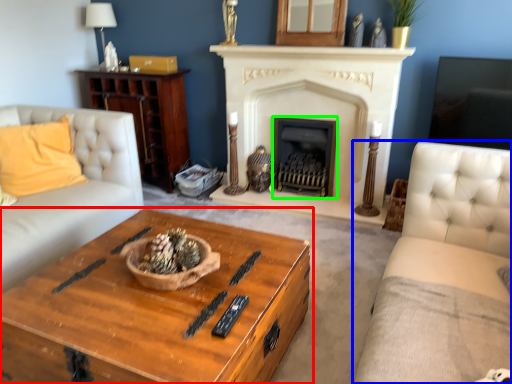
Question: Estimate the real-world distances between objects in this image. Which object is closer to coffee table (highlighted by a red box), studio couch (highlighted by a blue box) or fireplace (highlighted by a green box)?

Choices:
 (A) studio couch
 (B) fireplace

Answer: (A)